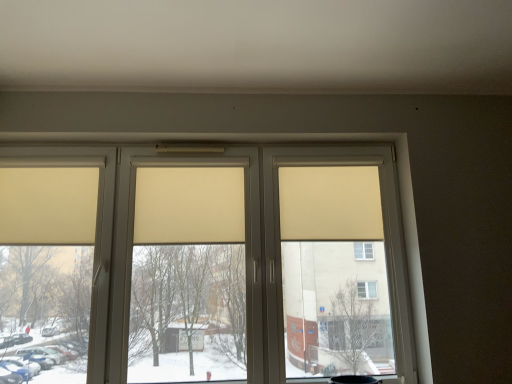
Question: Which direction should I rotate to face beige fabric curtain at center, which is counted as the 1th curtain, starting from the right, — up or down?

Choices:
 (A) down
 (B) up

Answer: (A)

Question: Is beige fabric curtain at center, placed as the third curtain when sorted from left to right, inside beige matte window at center?

Choices:
 (A) yes
 (B) no

Answer: (A)

Question: Is beige fabric curtain at center, which is counted as the 1th curtain, starting from the right, at the back of beige matte window at center?

Choices:
 (A) yes
 (B) no

Answer: (A)

Question: From a real-world perspective, is beige matte window at center physically below beige fabric curtain at center, which is counted as the 1th curtain, starting from the right?

Choices:
 (A) yes
 (B) no

Answer: (A)

Question: Can you see beige matte window at center touching beige fabric curtain at center, placed as the third curtain when sorted from left to right?

Choices:
 (A) yes
 (B) no

Answer: (B)

Question: Is beige matte window at center far away from beige fabric curtain at center, placed as the third curtain when sorted from left to right?

Choices:
 (A) yes
 (B) no

Answer: (B)

Question: Does beige matte window at center have a smaller size compared to beige fabric curtain at center, which is counted as the 1th curtain, starting from the right?

Choices:
 (A) no
 (B) yes

Answer: (A)

Question: Does beige fabric curtain at center, which is counted as the 1th curtain, starting from the right, have a lesser width compared to beige fabric curtain at center, positioned as the 2th curtain in right-to-left order?

Choices:
 (A) yes
 (B) no

Answer: (B)

Question: From a real-world perspective, is beige fabric curtain at center, placed as the third curtain when sorted from left to right, on top of beige fabric curtain at center, positioned as the 2th curtain in right-to-left order?

Choices:
 (A) no
 (B) yes

Answer: (B)

Question: Can you confirm if beige fabric curtain at center, which is counted as the 1th curtain, starting from the right, is wider than beige fabric curtain at center, the second curtain from the left?

Choices:
 (A) yes
 (B) no

Answer: (A)

Question: Is beige fabric curtain at center, which is counted as the 1th curtain, starting from the right, to the right of beige fabric curtain at center, the second curtain from the left, from the viewer's perspective?

Choices:
 (A) no
 (B) yes

Answer: (B)

Question: Is beige fabric curtain at center, which is counted as the 1th curtain, starting from the right, looking in the opposite direction of beige fabric curtain at center, the second curtain from the left?

Choices:
 (A) yes
 (B) no

Answer: (B)

Question: Does beige fabric curtain at center, which is counted as the 1th curtain, starting from the right, have a larger size compared to beige fabric curtain at center, the second curtain from the left?

Choices:
 (A) yes
 (B) no

Answer: (A)

Question: Is beige fabric curtain at left, which is the 3th curtain in right-to-left order, positioned beyond the bounds of beige matte window at center?

Choices:
 (A) no
 (B) yes

Answer: (A)